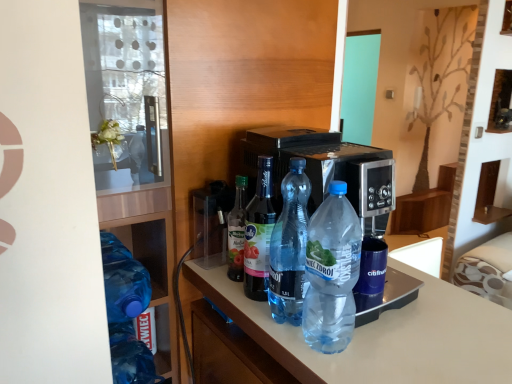
Question: Is point (274, 228) positioned closer to the camera than point (266, 251)?

Choices:
 (A) farther
 (B) closer

Answer: (B)

Question: From the image's perspective, relative to clear plastic bottle at center, marked as the 3th bottle in a left-to-right arrangement, is transparent plastic bottle at center, which appears as the fourth bottle when viewed from the left, above or below?

Choices:
 (A) above
 (B) below

Answer: (B)

Question: Which object is positioned farthest from the transparent plastic bottle at center, which appears as the fifth bottle when viewed from the left?

Choices:
 (A) transparent plastic bottle at center, the 2th bottle when ordered from right to left
 (B) transparent plastic bottles at left
 (C) blue translucent bottle at left, which is the 5th bottle from right to left
 (D) translucent plastic bottle at center, placed as the 4th bottle when sorted from right to left
 (E) clear plastic bottle at center, marked as the 3th bottle in a left-to-right arrangement

Answer: (C)

Question: Estimate the real-world distances between objects in this image. Which object is farther from the clear plastic bottle at center, marked as the 3th bottle in a left-to-right arrangement?

Choices:
 (A) transparent plastic bottles at left
 (B) transparent plastic bottle at center, which appears as the fourth bottle when viewed from the left
 (C) blue translucent bottle at left, which appears as the first bottle when viewed from the left
 (D) transparent plastic bottle at center, the 1th bottle viewed from the right
 (E) translucent plastic bottle at center, placed as the 4th bottle when sorted from right to left

Answer: (C)